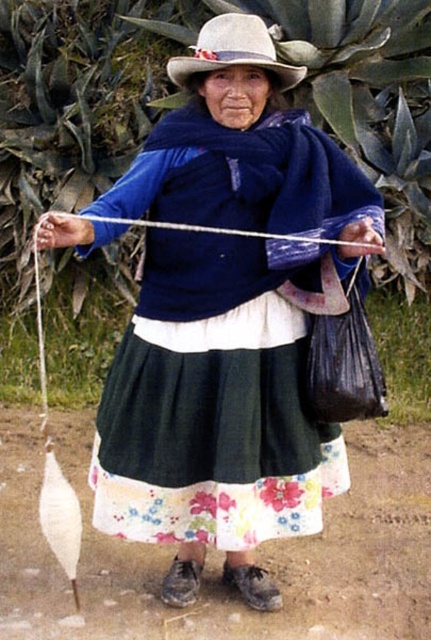
Question: Can you confirm if white felt cowboy hat at upper center is positioned above white string at center?

Choices:
 (A) yes
 (B) no

Answer: (A)

Question: Which of the following is the closest to the observer?

Choices:
 (A) (131, 426)
 (B) (53, 237)
 (C) (222, 61)

Answer: (B)

Question: Is matte blue sweater at center positioned at the back of white string at center?

Choices:
 (A) no
 (B) yes

Answer: (A)

Question: Does white felt cowboy hat at upper center appear on the right side of white string at center?

Choices:
 (A) yes
 (B) no

Answer: (B)

Question: Which point appears farthest from the camera in this image?

Choices:
 (A) (377, 248)
 (B) (244, 51)

Answer: (B)

Question: Which object appears closest to the camera in this image?

Choices:
 (A) matte blue sweater at center
 (B) white string at center

Answer: (A)